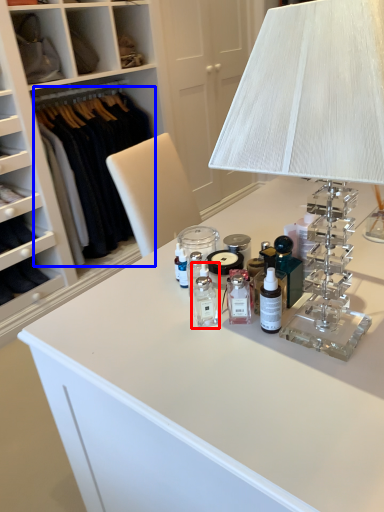
Question: Among these objects, which one is nearest to the camera, toiletry (highlighted by a red box) or clothing (highlighted by a blue box)?

Choices:
 (A) toiletry
 (B) clothing

Answer: (A)